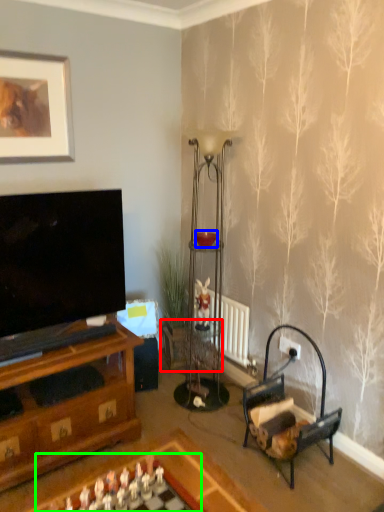
Question: Which object is positioned farthest from side table (highlighted by a red box)? Select from candle holder (highlighted by a blue box) and board game (highlighted by a green box).

Choices:
 (A) candle holder
 (B) board game

Answer: (B)